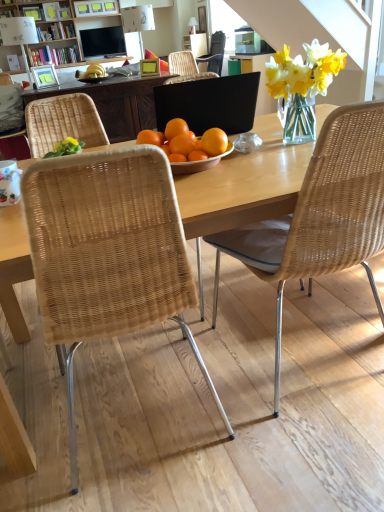
This screenshot has width=384, height=512. Identify the location of empty space that is to the right of woven wicker chair at center, which appears as the 1th chair when viewed from the front. (273, 434).